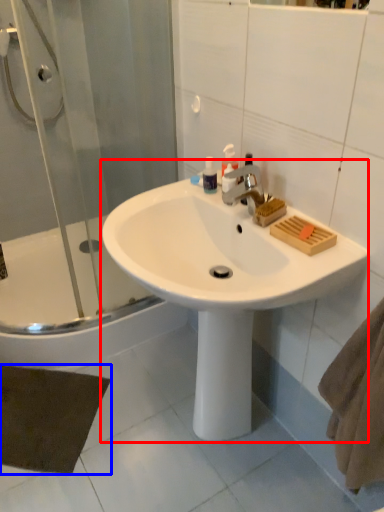
Question: Which object appears closest to the camera in this image, sink (highlighted by a red box) or bath mat (highlighted by a blue box)?

Choices:
 (A) sink
 (B) bath mat

Answer: (A)